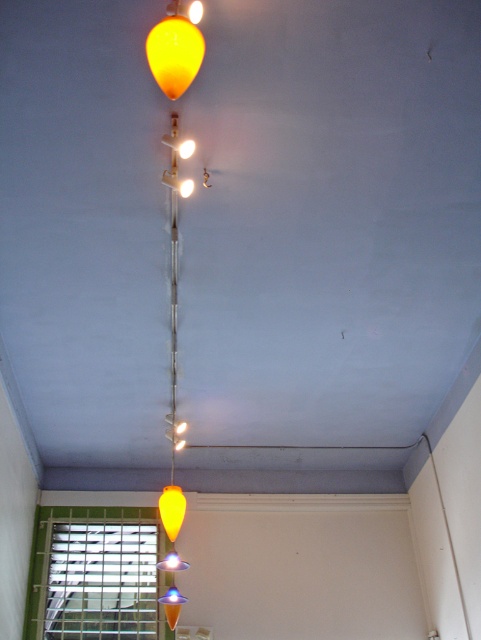
At what (x,y) coordinates should I click in order to perform the action: click on translucent yellow balloon at upper center. Please return your answer as a coordinate pair (x, y). The height and width of the screenshot is (640, 481). Looking at the image, I should click on (175, 52).

Does translucent yellow balloon at upper center have a greater width compared to matte yellow cone at center?

Yes.

Is point (175, 68) behind point (180, 499)?

No, (175, 68) is closer to viewer.

Image resolution: width=481 pixels, height=640 pixels. Find the location of `translucent yellow balloon at upper center`. translucent yellow balloon at upper center is located at coordinates (175, 52).